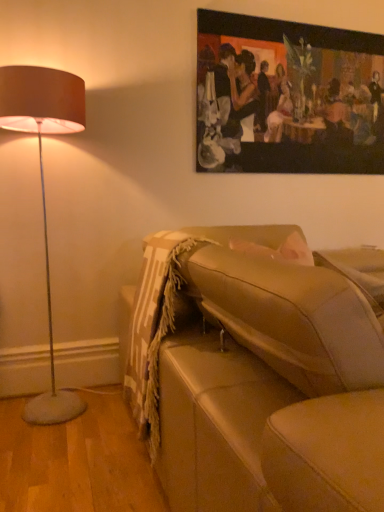
Identify the location of beige leather couch at lower right. The height and width of the screenshot is (512, 384). (257, 375).

What do you see at coordinates (257, 375) in the screenshot? I see `beige leather couch at lower right` at bounding box center [257, 375].

The width and height of the screenshot is (384, 512). Identify the location of oil painting at upper center. (288, 97).

The height and width of the screenshot is (512, 384). Describe the element at coordinates (288, 97) in the screenshot. I see `oil painting at upper center` at that location.

Based on the photo, measure the distance between point (x=209, y=12) and camera.

7.50 feet.

The width and height of the screenshot is (384, 512). Identify the location of beige leather couch at lower right. [257, 375].

Considering the relative positions of oil painting at upper center and beige leather couch at lower right in the image provided, is oil painting at upper center to the right of beige leather couch at lower right from the viewer's perspective?

Yes.

Which object is closer to the camera, oil painting at upper center or beige leather couch at lower right?

beige leather couch at lower right.

Is point (205, 63) closer or farther from the camera than point (232, 343)?

Point (205, 63) is positioned farther from the camera compared to point (232, 343).

From the image's perspective, is oil painting at upper center on top of beige leather couch at lower right?

Yes.

From a real-world perspective, is oil painting at upper center located higher than beige leather couch at lower right?

Yes, from a real-world perspective, oil painting at upper center is on top of beige leather couch at lower right.

Can you confirm if oil painting at upper center is wider than beige leather couch at lower right?

No.

Is oil painting at upper center taller than beige leather couch at lower right?

Yes.

In terms of size, does oil painting at upper center appear bigger or smaller than beige leather couch at lower right?

Considering their sizes, oil painting at upper center takes up less space than beige leather couch at lower right.

Is beige leather couch at lower right located within oil painting at upper center?

Definitely not — beige leather couch at lower right is not inside oil painting at upper center.

Consider the image. Is oil painting at upper center beside beige leather couch at lower right?

No, oil painting at upper center is not making contact with beige leather couch at lower right.

Is oil painting at upper center turned away from beige leather couch at lower right?

No, oil painting at upper center is not facing the opposite direction of beige leather couch at lower right.

Where is `picture frame on the right of beige leather couch at lower right`? picture frame on the right of beige leather couch at lower right is located at coordinates (288, 97).

Considering the positions of objects beige leather couch at lower right and oil painting at upper center in the image provided, who is more to the right, beige leather couch at lower right or oil painting at upper center?

From the viewer's perspective, oil painting at upper center appears more on the right side.

Is beige leather couch at lower right closer to camera compared to oil painting at upper center?

Yes, beige leather couch at lower right is closer to the camera.

Does point (335, 343) appear closer or farther from the camera than point (261, 27)?

Point (335, 343) is positioned closer to the camera compared to point (261, 27).

From the image's perspective, which one is positioned lower, beige leather couch at lower right or oil painting at upper center?

From the image's view, beige leather couch at lower right is below.

From a real-world perspective, is beige leather couch at lower right positioned over oil painting at upper center based on gravity?

Actually, beige leather couch at lower right is physically below oil painting at upper center in the real world.

Which of these two, beige leather couch at lower right or oil painting at upper center, is wider?

Wider between the two is beige leather couch at lower right.

Which of these two, beige leather couch at lower right or oil painting at upper center, stands shorter?

beige leather couch at lower right.

Between beige leather couch at lower right and oil painting at upper center, which one has larger size?

beige leather couch at lower right is bigger.

Is oil painting at upper center surrounded by beige leather couch at lower right?

No, beige leather couch at lower right does not contain oil painting at upper center.

Are beige leather couch at lower right and oil painting at upper center far apart?

beige leather couch at lower right is far away from oil painting at upper center.

Could you tell me if beige leather couch at lower right is turned towards oil painting at upper center?

No, beige leather couch at lower right is not oriented towards oil painting at upper center.

Looking at this image, what's the angular difference between beige leather couch at lower right and oil painting at upper center's facing directions?

The angle between the facing direction of beige leather couch at lower right and the facing direction of oil painting at upper center is 87.3 degrees.

Consider the image. How far apart are beige leather couch at lower right and oil painting at upper center?

1.13 meters.

Identify the location of studio couch located underneath the oil painting at upper center (from a real-world perspective). Image resolution: width=384 pixels, height=512 pixels. (257, 375).

Find the location of a particular element. studio couch that is on the left side of oil painting at upper center is located at coordinates (257, 375).

I want to click on studio couch that appears in front of the oil painting at upper center, so pyautogui.click(x=257, y=375).